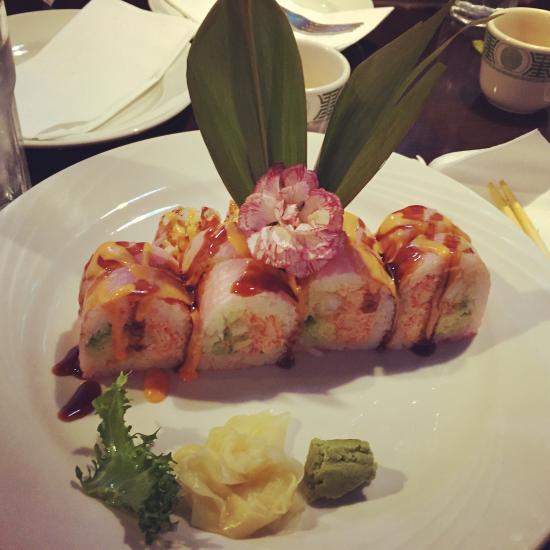
This screenshot has height=550, width=550. Find the location of `glass`. glass is located at coordinates (14, 148).